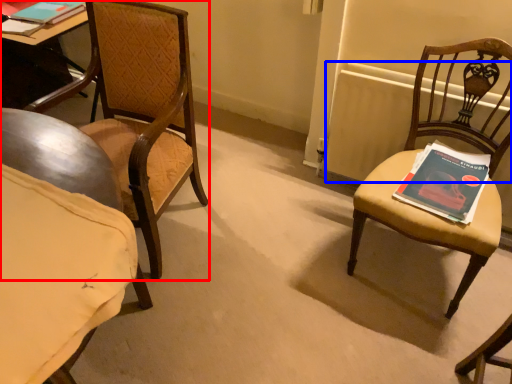
Question: Which object appears closest to the camera in this image, chair (highlighted by a red box) or radiator (highlighted by a blue box)?

Choices:
 (A) chair
 (B) radiator

Answer: (A)